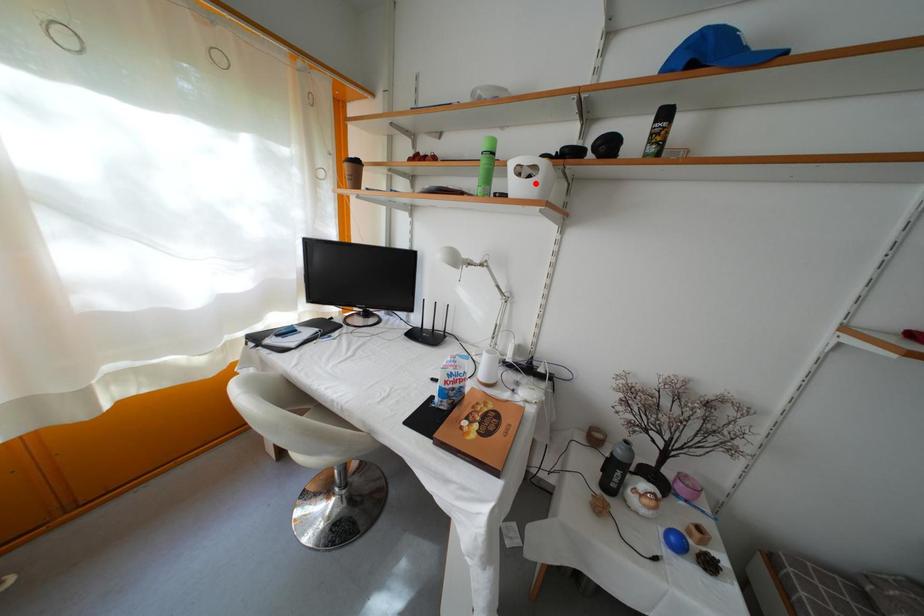
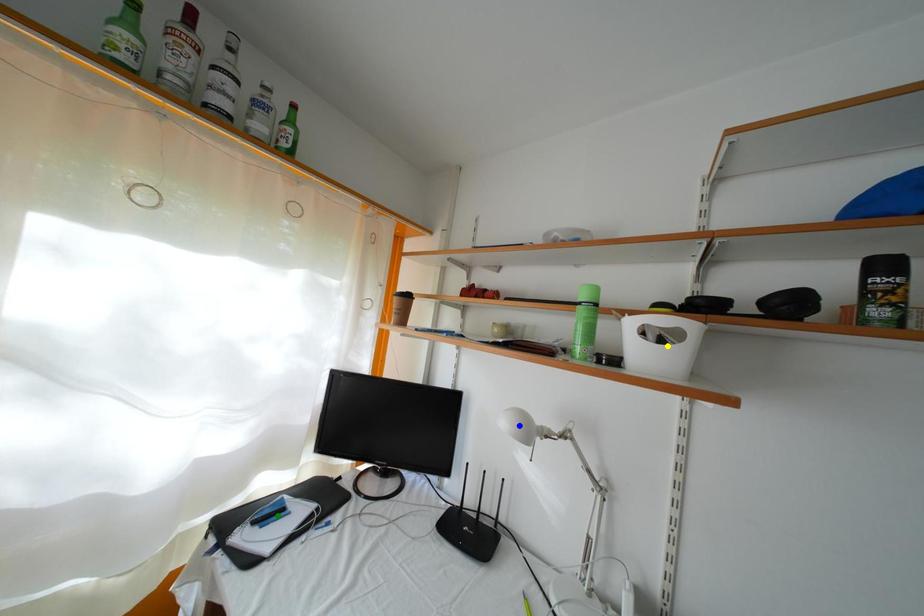
Question: I am providing you with two images of the same scene from different viewpoints. A red point is marked on the first image. You are given multiple points on the second image. Which spot in image 2 lines up with the point in image 1?

Choices:
 (A) blue point
 (B) yellow point
 (C) green point

Answer: (B)